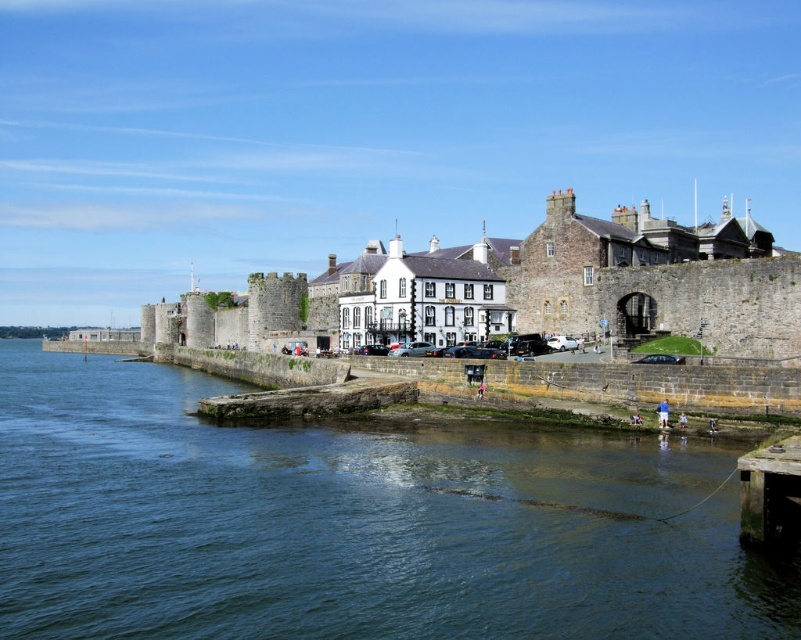
Question: Can you confirm if green stone river at center is smaller than smooth concrete dock at lower right?

Choices:
 (A) no
 (B) yes

Answer: (A)

Question: Can you confirm if green stone river at center is positioned below smooth concrete dock at lower right?

Choices:
 (A) yes
 (B) no

Answer: (A)

Question: Is the position of green stone river at center less distant than that of smooth concrete dock at lower right?

Choices:
 (A) yes
 (B) no

Answer: (A)